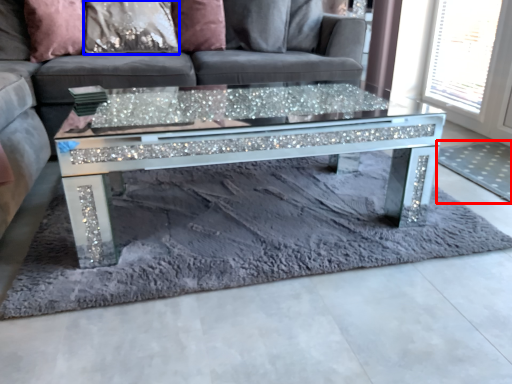
Question: Which object is further to the camera taking this photo, mat (highlighted by a red box) or pillow (highlighted by a blue box)?

Choices:
 (A) mat
 (B) pillow

Answer: (B)